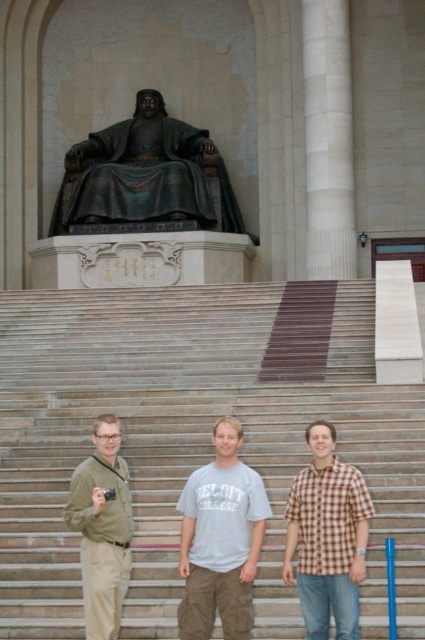
You are standing on the smooth stone stairs at center and want to take a photo of the khaki cotton pants at lower left. Which direction should you move to get a better angle?

You should move towards the khaki cotton pants at lower left because the smooth stone stairs at center are further away from you than the khaki cotton pants at lower left, allowing for a closer shot.